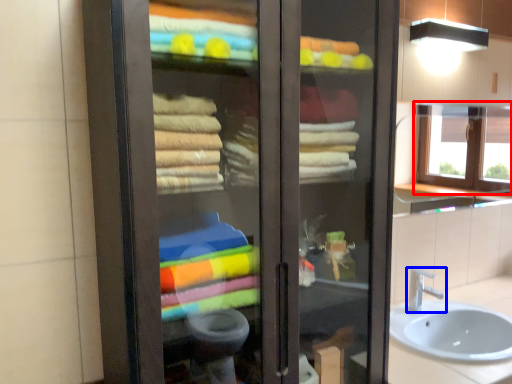
Question: Which object is closer to the camera taking this photo, window (highlighted by a red box) or tap (highlighted by a blue box)?

Choices:
 (A) window
 (B) tap

Answer: (B)